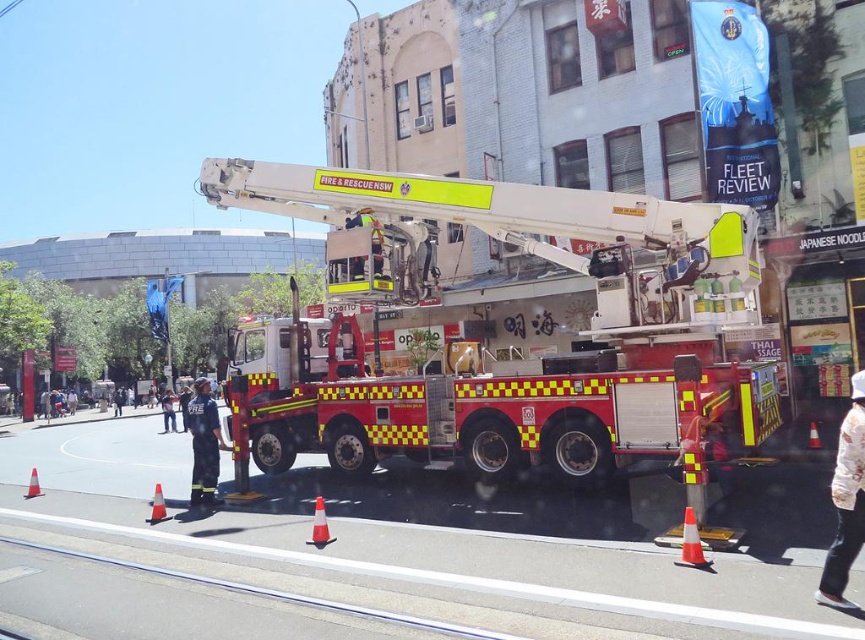
Is red/yellow checkered fire truck at center positioned in front of firefighter uniform at center?

Yes, it is.

Which is behind, point (742, 440) or point (188, 408)?

Point (188, 408)

At what (x,y) coordinates should I click in order to perform the action: click on red/yellow checkered fire truck at center. Please return your answer as a coordinate pair (x, y). The image size is (865, 640). Looking at the image, I should click on (497, 369).

Does floral-patterned shirt at lower right have a lesser height compared to orange reflective traffic cone at lower center?

Incorrect, floral-patterned shirt at lower right's height does not fall short of orange reflective traffic cone at lower center's.

Is point (853, 420) more distant than point (315, 541)?

That is False.

Find the location of a particular element. Image resolution: width=865 pixels, height=640 pixels. floral-patterned shirt at lower right is located at coordinates (846, 502).

Where is `floral-patterned shirt at lower right`? The width and height of the screenshot is (865, 640). floral-patterned shirt at lower right is located at coordinates (846, 502).

Is reflective silver helmet at center above orange reflective traffic cone at center?

No.

Between reflective silver helmet at center and orange reflective traffic cone at center, which one has less height?

With less height is orange reflective traffic cone at center.

Does point (167, 422) lie behind point (811, 435)?

Yes, it is behind point (811, 435).

In order to click on reflective silver helmet at center in this screenshot , I will do `click(168, 410)`.